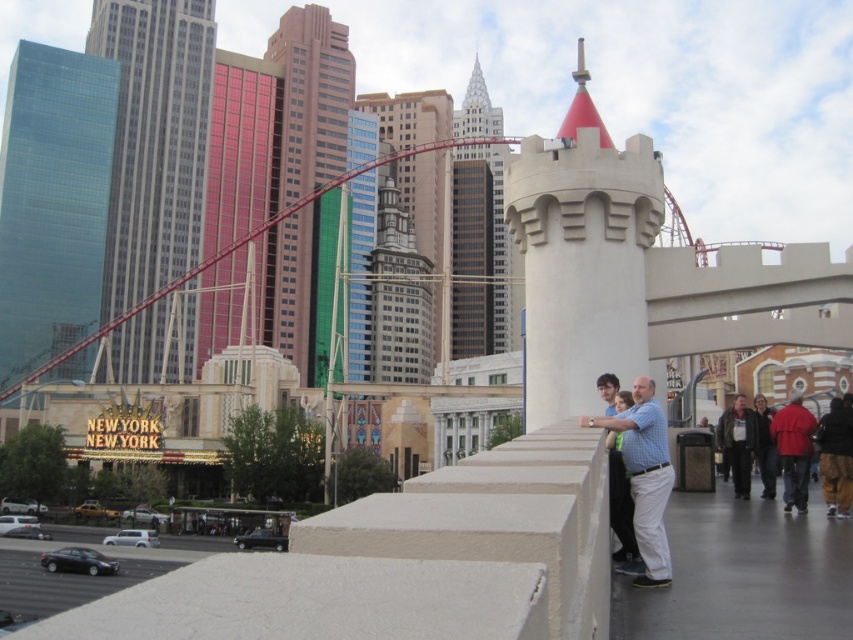
Question: Observing the image, what is the correct spatial positioning of metallic glass skyscraper at center in reference to red jacket at lower right?

Choices:
 (A) left
 (B) right

Answer: (A)

Question: Which point is farther from the camera taking this photo?

Choices:
 (A) (805, 504)
 (B) (801, 477)
 (C) (38, 236)

Answer: (C)

Question: Estimate the real-world distances between objects in this image. Which object is closer to the metallic glass skyscraper at center?

Choices:
 (A) white stone tower at center
 (B) glassy steel roller coaster at upper left
 (C) red jacket at lower right

Answer: (B)

Question: Which object is closer to the camera taking this photo?

Choices:
 (A) glassy steel roller coaster at upper left
 (B) red matte jacket at right
 (C) glassy steel skyscraper at center
 (D) white stone tower at center

Answer: (B)

Question: From the image, what is the correct spatial relationship of blue plaid shirt at center in relation to red matte jacket at right?

Choices:
 (A) above
 (B) below

Answer: (A)

Question: Is glassy blue skyscraper at left closer to camera compared to glassy steel skyscraper at center?

Choices:
 (A) no
 (B) yes

Answer: (B)